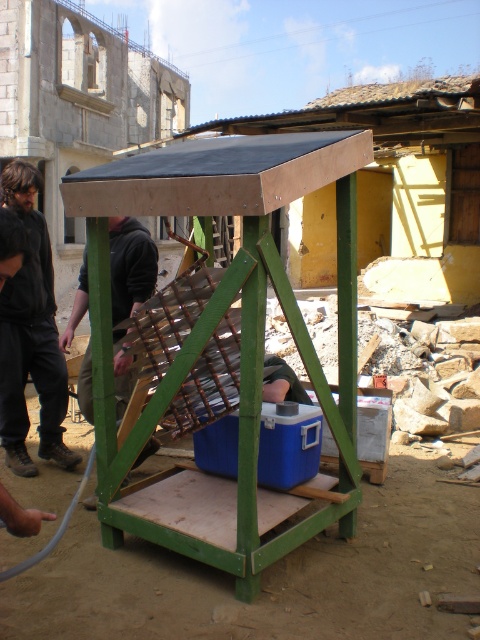
You are standing at the base of the wooden structure and want to pick up the dark brown leather jacket at left. Is the wooden crate at center blocking your path to the jacket?

The wooden crate at center is closer to the viewer than the dark brown leather jacket at left, so the wooden crate at center is in front of the jacket. This means the wooden crate at center is blocking your path to the dark brown leather jacket at left.

You are standing in front of the wooden structure and want to pick up both the dark brown leather jacket at left and the dark gray hoodie at center. Which item will you need to reach for first due to its position relative to you?

The dark brown leather jacket at left is closer to you than the dark gray hoodie at center, so you should reach for the dark brown leather jacket at left first.